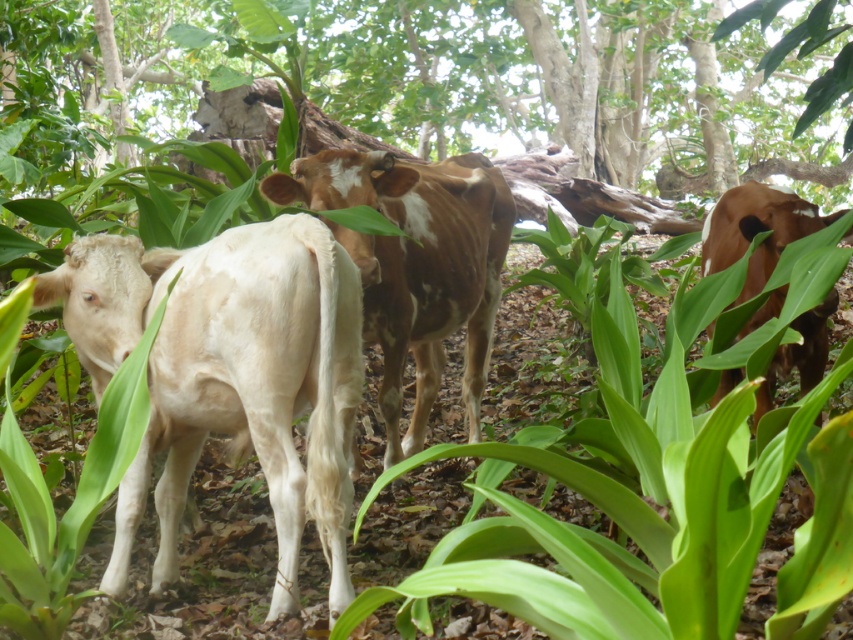
Question: Which point appears closest to the camera in this image?

Choices:
 (A) (798, 216)
 (B) (402, 355)

Answer: (A)

Question: Considering the relative positions of white smooth cow at left and brown speckled hide at center in the image provided, where is white smooth cow at left located with respect to brown speckled hide at center?

Choices:
 (A) below
 (B) above

Answer: (A)

Question: Does brown speckled hide at center appear under brown glossy cow at right?

Choices:
 (A) no
 (B) yes

Answer: (A)

Question: Is white smooth cow at left above brown glossy cow at right?

Choices:
 (A) yes
 (B) no

Answer: (B)

Question: Which object appears farthest from the camera in this image?

Choices:
 (A) brown glossy cow at right
 (B) brown speckled hide at center
 (C) white smooth cow at left

Answer: (B)

Question: Which point appears farthest from the camera in this image?

Choices:
 (A) (474, 387)
 (B) (347, 344)

Answer: (A)